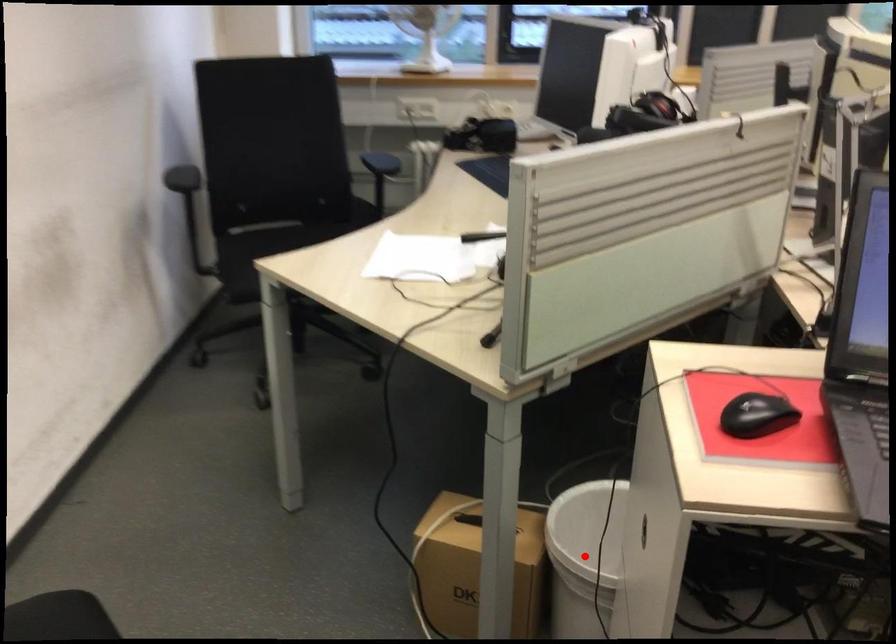
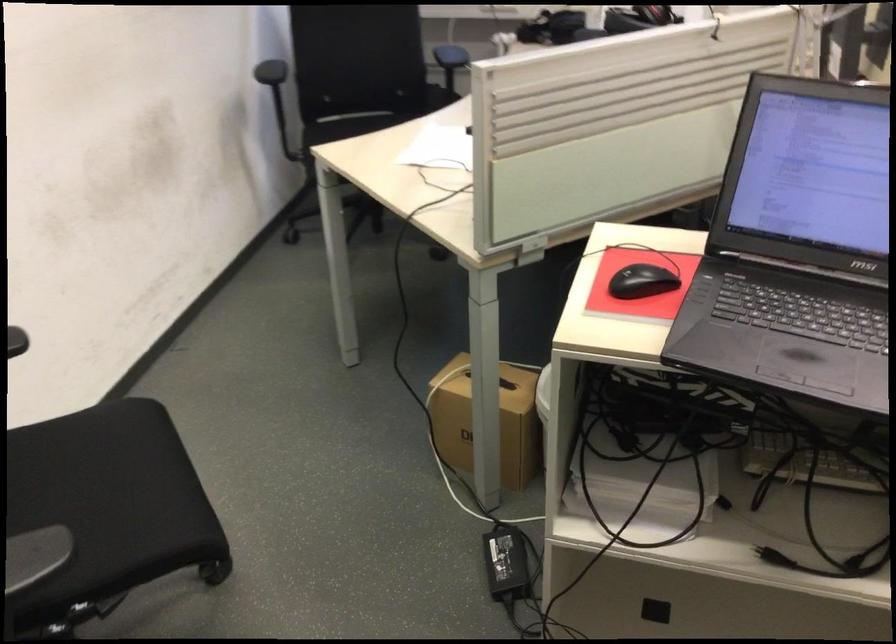
Question: I am providing you with two images of the same scene from different viewpoints. A red point is marked on the first image. Can you still see the location of the red point in image 2?

Choices:
 (A) Yes
 (B) No

Answer: (B)